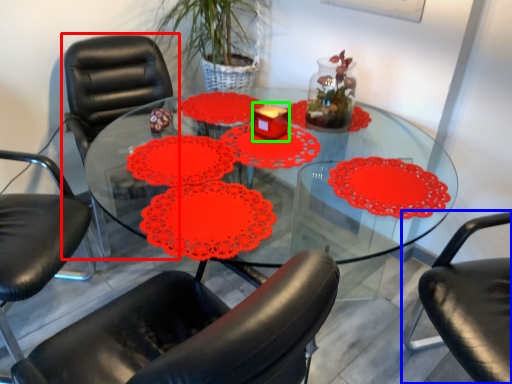
Question: Which is farther away from chair (highlighted by a red box)? chair (highlighted by a blue box) or candle holder (highlighted by a green box)?

Choices:
 (A) chair
 (B) candle holder

Answer: (A)